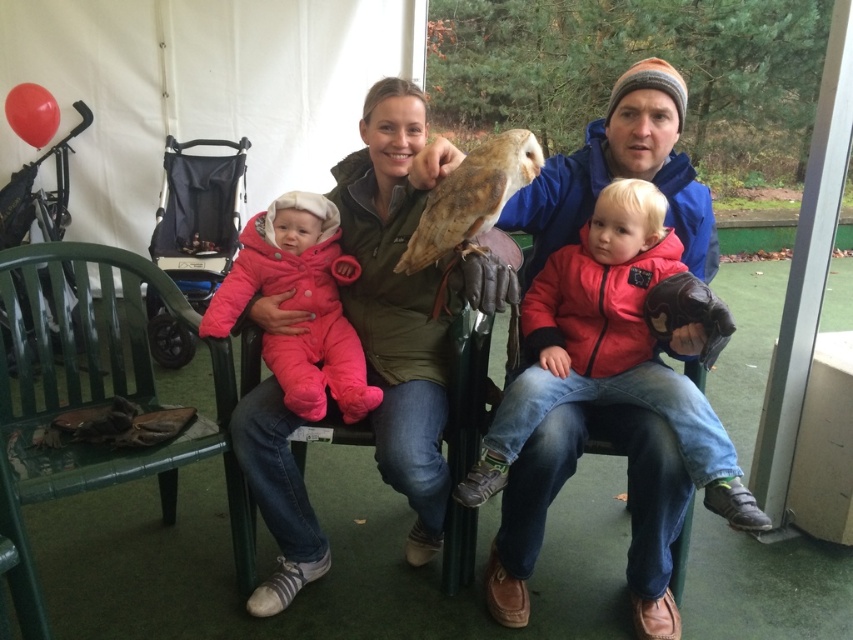
Question: Among these objects, which one is farthest from the camera?

Choices:
 (A) matte green jacket at center
 (B) brown feathered owl at center
 (C) dark gray fabric stroller at left

Answer: (C)

Question: Is matte green jacket at center smaller than dark gray fabric stroller at left?

Choices:
 (A) yes
 (B) no

Answer: (B)

Question: Does matte green jacket at center come in front of brown feathered owl at center?

Choices:
 (A) yes
 (B) no

Answer: (B)

Question: Among these objects, which one is nearest to the camera?

Choices:
 (A) blue fleece jacket at center
 (B) matte green jacket at center

Answer: (A)

Question: Which object is positioned farthest from the pink fleece snowsuit at center?

Choices:
 (A) brown feathered owl at center
 (B) dark gray fabric stroller at left

Answer: (B)

Question: Considering the relative positions of matte green jacket at center and blue fleece jacket at center in the image provided, where is matte green jacket at center located with respect to blue fleece jacket at center?

Choices:
 (A) above
 (B) below

Answer: (B)